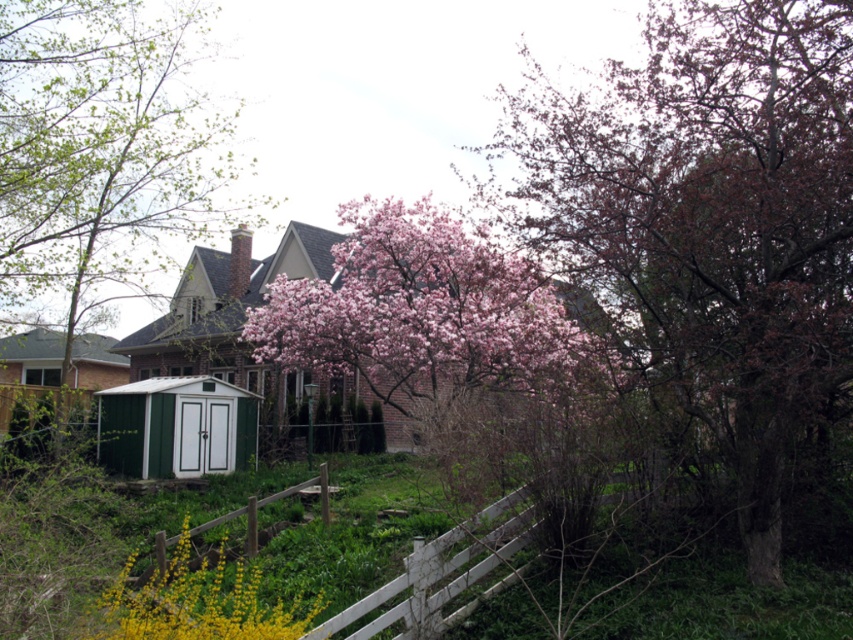
Can you confirm if yellow matte flower at lower left is positioned to the left of green painted wood shed at lower left?

Incorrect, yellow matte flower at lower left is not on the left side of green painted wood shed at lower left.

Is yellow matte flower at lower left above green painted wood shed at lower left?

No.

This screenshot has height=640, width=853. I want to click on yellow matte flower at lower left, so click(196, 602).

Does yellow matte flower at lower left have a greater width compared to green plastic shed at lower left?

In fact, yellow matte flower at lower left might be narrower than green plastic shed at lower left.

Can you confirm if yellow matte flower at lower left is shorter than green plastic shed at lower left?

Correct, yellow matte flower at lower left is not as tall as green plastic shed at lower left.

You are a GUI agent. You are given a task and a screenshot of the screen. Output one action in this format:
    pyautogui.click(x=<x>, y=<y>)
    Task: Click on the yellow matte flower at lower left
    The width and height of the screenshot is (853, 640).
    Given the screenshot: What is the action you would take?
    point(196,602)

Can you confirm if pink bloom at center is positioned to the right of green plastic shed at lower left?

Indeed, pink bloom at center is positioned on the right side of green plastic shed at lower left.

Is point (285, 305) positioned behind point (210, 376)?

No, it is not.

The width and height of the screenshot is (853, 640). I want to click on pink bloom at center, so click(422, 310).